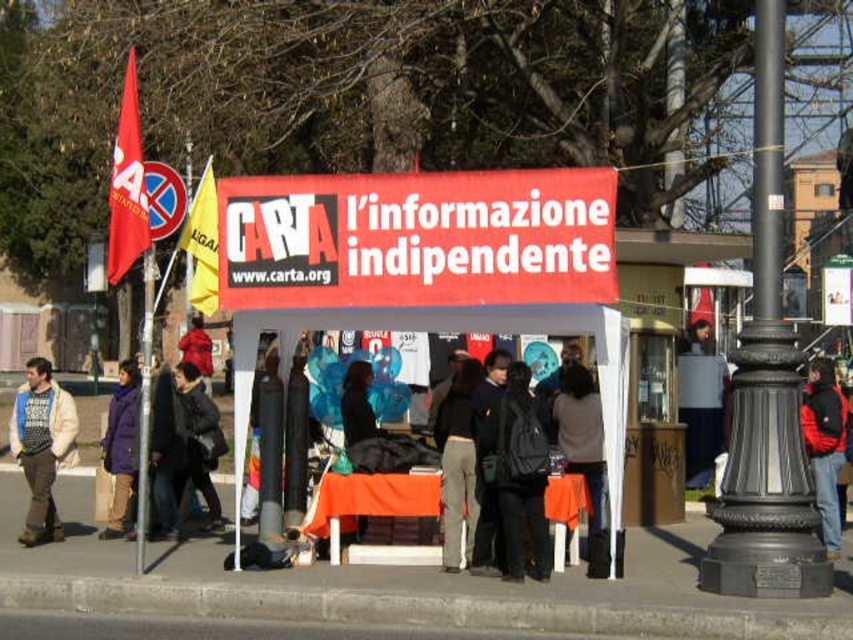
Question: Which of these objects is positioned farthest from the metallic pole at left?

Choices:
 (A) black cast iron pole at right
 (B) red wool coat at center
 (C) purple fleece jacket at lower left

Answer: (A)

Question: Can you confirm if matte blue sweater at left is positioned to the left of dark brown leather jacket at center?

Choices:
 (A) yes
 (B) no

Answer: (A)

Question: Does matte blue sweater at left have a smaller size compared to metallic pole at upper center?

Choices:
 (A) yes
 (B) no

Answer: (A)

Question: Which point is closer to the camera taking this photo?

Choices:
 (A) (209, 390)
 (B) (366, 262)
 (C) (137, 477)

Answer: (B)

Question: Which is nearer to the red wool coat at center?

Choices:
 (A) purple fleece jacket at lower left
 (B) matte blue sweater at left

Answer: (B)

Question: Is white fabric tent at center thinner than dark gray jacket at center?

Choices:
 (A) yes
 (B) no

Answer: (B)